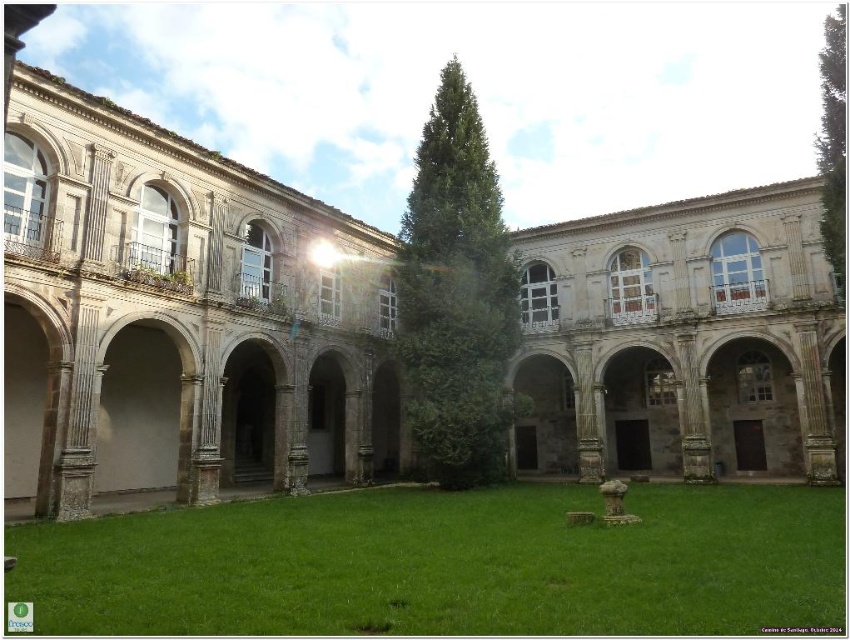
You are a gardener who needs to mow the lawn in the courtyard. The green leafy tree at center has branches that extend over the green grass at center. Can you safely mow the grass without damaging the tree?

The green grass at center is not as tall as the green leafy tree at center, so the tree branches are higher than the grass. You can safely mow the grass without damaging the tree as long as you avoid the tree trunk and ensure the mower doesn

You are standing in the courtyard of a historic building and need to find the green grass at center. Based on the coordinates provided, can you determine its exact location?

The green grass at center is located at coordinates point (x=445, y=564).

You are standing in the courtyard and want to find a spot where both the green leafy tree at center and the green leafy tree at right are visible. Based on their positions, which direction should you face to ensure both are in your view?

The green leafy tree at center is below the green leafy tree at right, so facing upwards from the lower area would allow you to see both trees simultaneously.